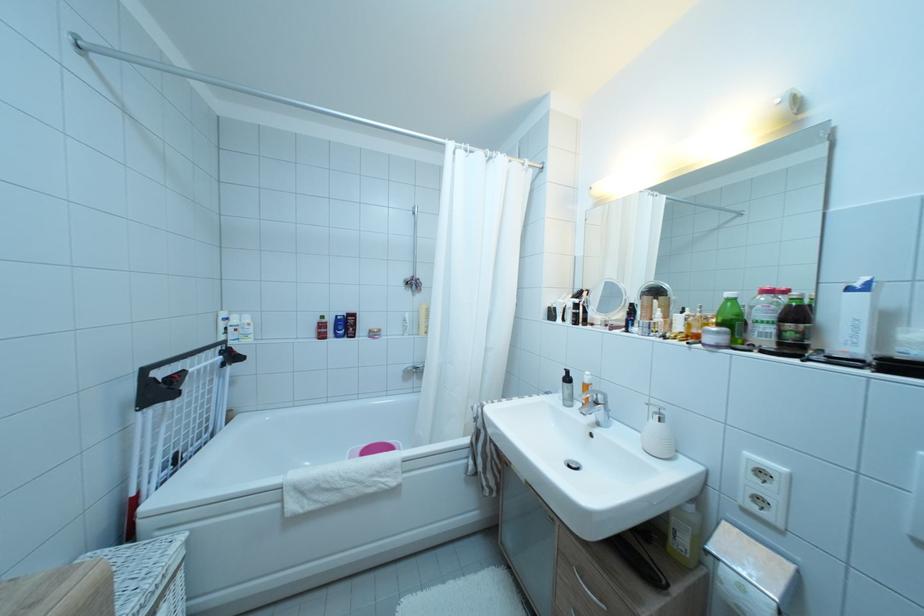
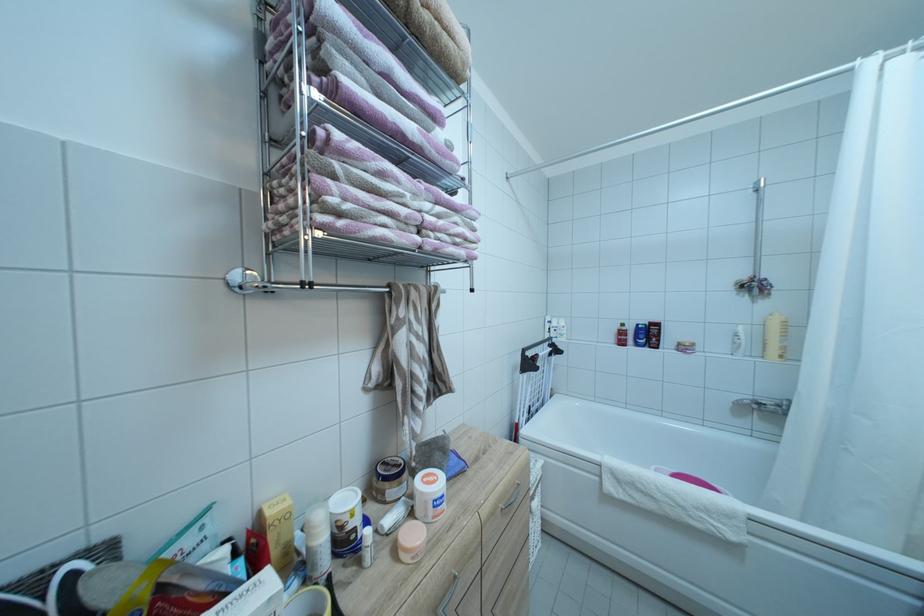
Find the pixel in the second image that matches [430,334] in the first image.

(781, 357)